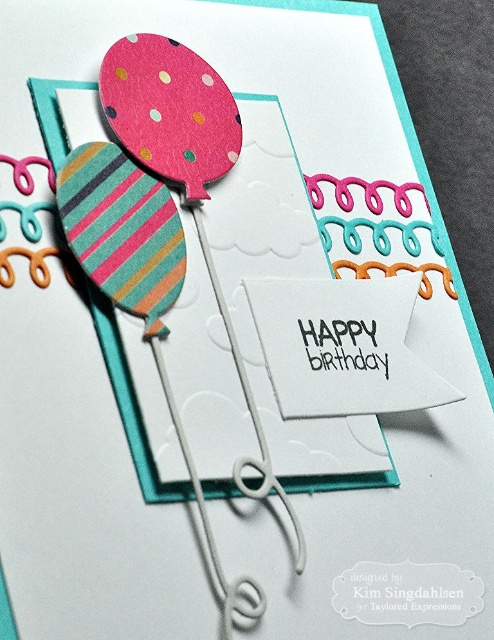
Question: Does striped paper balloon at left appear over polka dot paper balloon at upper left?

Choices:
 (A) no
 (B) yes

Answer: (A)

Question: Which is nearer to the striped paper balloon at left?

Choices:
 (A) white wire at center
 (B) polka dot paper balloon at upper left

Answer: (B)

Question: Based on their relative distances, which object is nearer to the striped paper balloon at left?

Choices:
 (A) white wire at center
 (B) polka dot paper balloon at upper left

Answer: (B)

Question: Does polka dot paper balloon at upper left appear on the right side of white wire at center?

Choices:
 (A) yes
 (B) no

Answer: (B)

Question: Which of the following is the closest to the observer?

Choices:
 (A) striped paper balloon at left
 (B) white wire at center
 (C) polka dot paper balloon at upper left

Answer: (B)

Question: In this image, where is striped paper balloon at left located relative to white wire at center?

Choices:
 (A) above
 (B) below

Answer: (A)